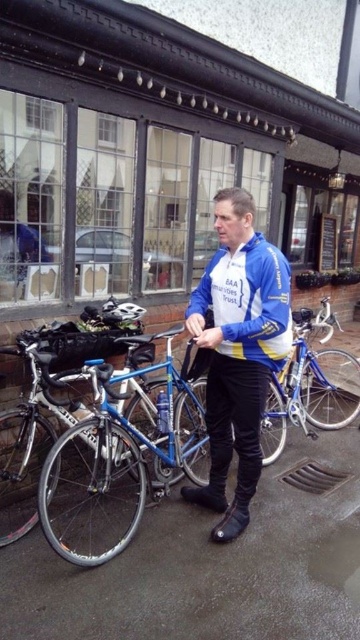
You are standing at the point closest to the building in the scene. There are two points marked in the image, one at point (x=347, y=540) and the other at point (x=29, y=349). Which point is farther away from you?

Point (x=347, y=540) is behind point (x=29, y=349), so it is farther away from you.

You are a pedestrian walking on the concrete pavement at center. You want to pick up the blue fabric jacket at center. Can you reach it without moving from your current position?

The concrete pavement at center is closer to the viewer than the blue fabric jacket at center, so you cannot reach it without moving closer.

You are standing at the entrance of the building shown in the scene. You want to walk to the concrete pavement at center. Which direction should you walk?

The concrete pavement at center is located at point [209,564], so you should walk forward towards the center of the scene to reach it.